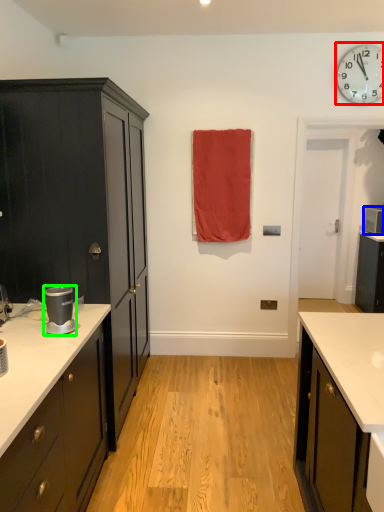
Question: Which object is the closest to the wall clock (highlighted by a red box)? Choose among these: appliance (highlighted by a blue box) or appliance (highlighted by a green box).

Choices:
 (A) appliance
 (B) appliance

Answer: (A)